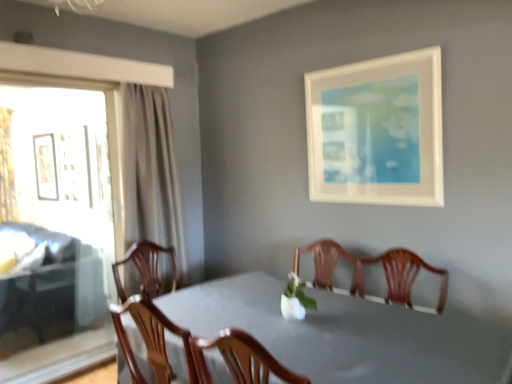
Question: Considering their positions, is matte black picture frame at left, which appears as the 1th picture frame when viewed from the back, located in front of or behind transparent glass window at left?

Choices:
 (A) front
 (B) behind

Answer: (B)

Question: Choose the correct answer: Is matte black picture frame at left, which ranks as the second picture frame in right-to-left order, inside transparent glass window at left or outside it?

Choices:
 (A) inside
 (B) outside

Answer: (B)

Question: Which object is the closest to the white matte picture frame at upper right, which ranks as the 1th picture frame in front-to-back order?

Choices:
 (A) transparent glass window at left
 (B) white matte vase at center
 (C) gold textured curtain at left
 (D) matte black picture frame at left, the 1th picture frame viewed from the left
 (E) smooth gray table at center

Answer: (B)

Question: Which object is positioned closest to the matte black picture frame at left, arranged as the 2th picture frame when viewed from the front?

Choices:
 (A) gold textured curtain at left
 (B) white matte vase at center
 (C) transparent glass window at left
 (D) white matte picture frame at upper right, which ranks as the 1th picture frame in front-to-back order
 (E) smooth gray table at center

Answer: (A)